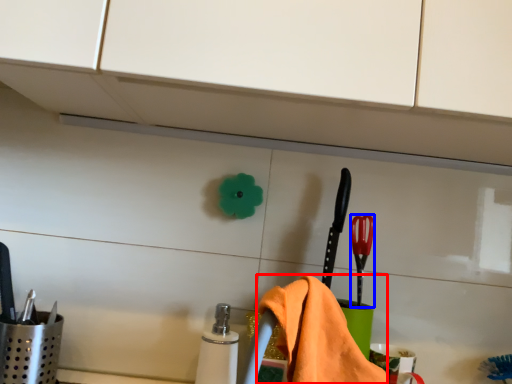
Question: Which of the following is the closest to the observer, bath towel (highlighted by a red box) or brush (highlighted by a blue box)?

Choices:
 (A) bath towel
 (B) brush

Answer: (A)